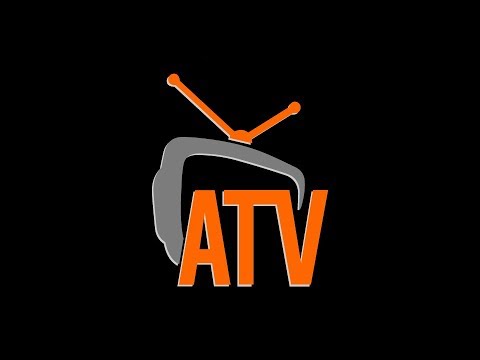
This screenshot has width=480, height=360. Find the location of `left side grey border tv`. left side grey border tv is located at coordinates (171, 241), (169, 205), (178, 146).